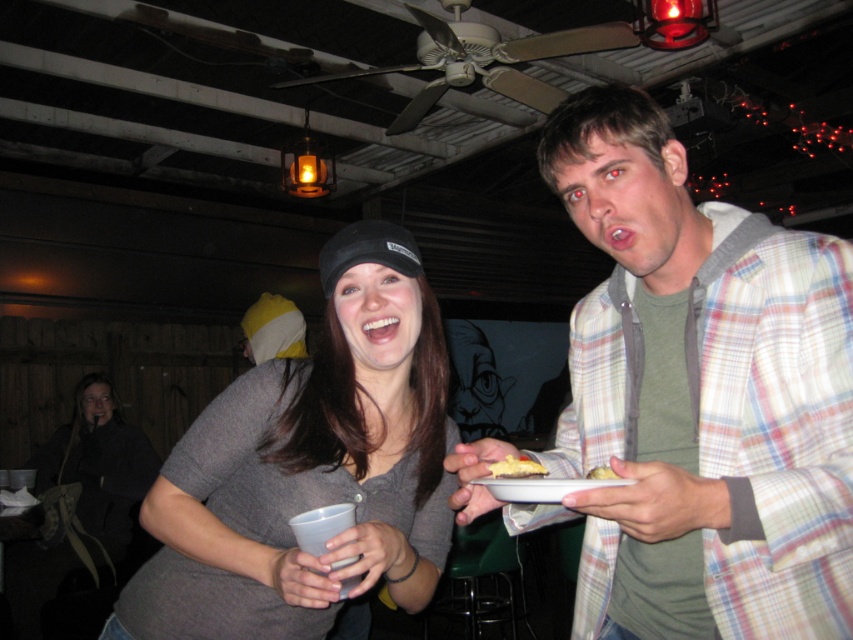
Does yellow creamy cake at center have a greater width compared to yellow cake at center?

Yes, yellow creamy cake at center is wider than yellow cake at center.

Does point (537, 472) come in front of point (613, 476)?

No, it is not.

Locate an element on the screen. Image resolution: width=853 pixels, height=640 pixels. yellow creamy cake at center is located at coordinates (515, 467).

Is matte gray shirt at center below yellow creamy cake at center?

Actually, matte gray shirt at center is above yellow creamy cake at center.

Is matte gray shirt at center further to the viewer compared to yellow creamy cake at center?

No, it is not.

I want to click on matte gray shirt at center, so click(309, 467).

Is point (788, 444) closer to viewer compared to point (314, 355)?

That is True.

Is plaid shirt at upper right wider than matte gray shirt at center?

In fact, plaid shirt at upper right might be narrower than matte gray shirt at center.

Is point (641, 184) positioned behind point (383, 529)?

Yes, point (641, 184) is behind point (383, 529).

Image resolution: width=853 pixels, height=640 pixels. I want to click on plaid shirt at upper right, so click(698, 396).